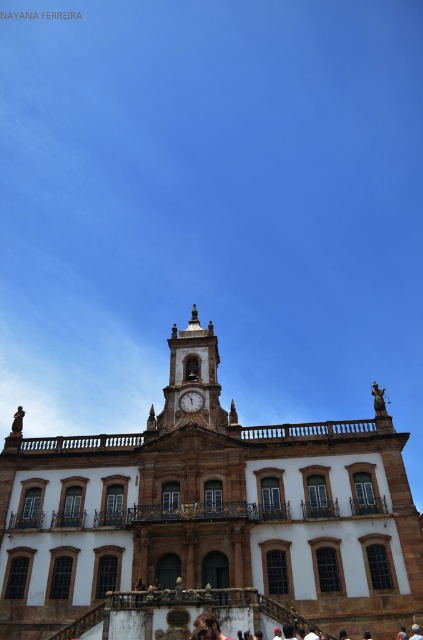
Is brown stone church at center bigger than gold ornate clock tower at center?

Indeed, brown stone church at center has a larger size compared to gold ornate clock tower at center.

Measure the distance from brown stone church at center to gold ornate clock tower at center.

brown stone church at center is 8.41 meters from gold ornate clock tower at center.

Is point (343, 531) positioned behind point (173, 422)?

No.

The width and height of the screenshot is (423, 640). What are the coordinates of `brown stone church at center` in the screenshot? It's located at (208, 520).

Measure the distance between brown stone church at center and matte brown clock at center.

brown stone church at center and matte brown clock at center are 43.63 feet apart.

Who is more distant from viewer, (110, 620) or (181, 404)?

The point (181, 404) is more distant.

This screenshot has height=640, width=423. Find the location of `brown stone church at center`. brown stone church at center is located at coordinates (208, 520).

Is gold ornate clock tower at center closer to the viewer compared to matte brown clock at center?

Yes, gold ornate clock tower at center is in front of matte brown clock at center.

This screenshot has width=423, height=640. What do you see at coordinates (192, 378) in the screenshot?
I see `gold ornate clock tower at center` at bounding box center [192, 378].

Who is more distant from viewer, [158,420] or [186,408]?

The point [186,408] is more distant.

Identify the location of gold ornate clock tower at center. (192, 378).